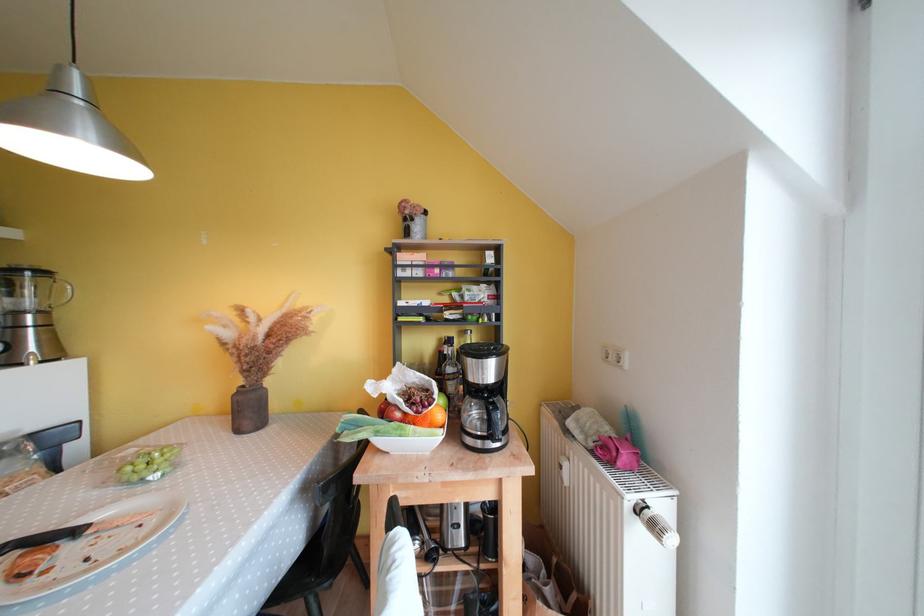
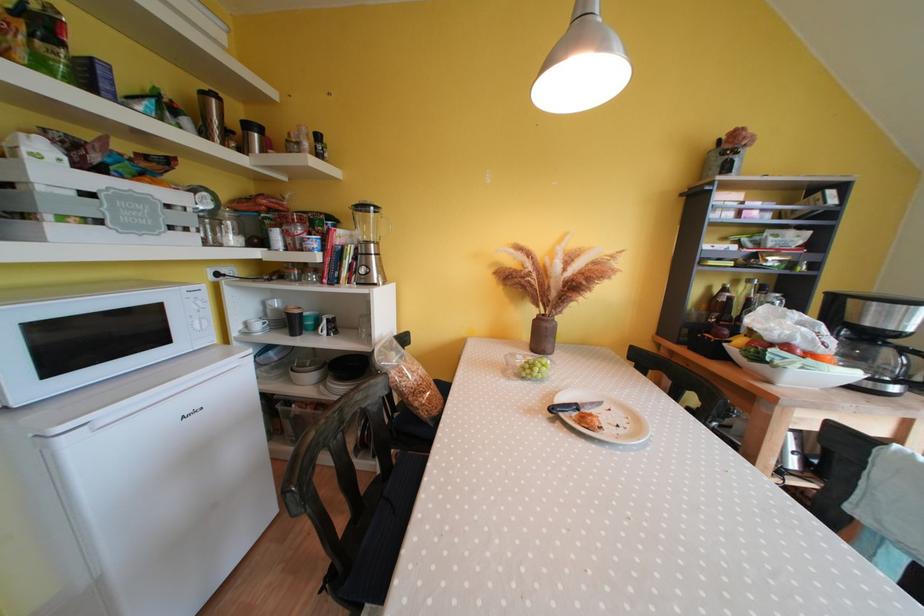
Locate, in the second image, the point that corresponds to (x=93, y=562) in the first image.

(624, 430)